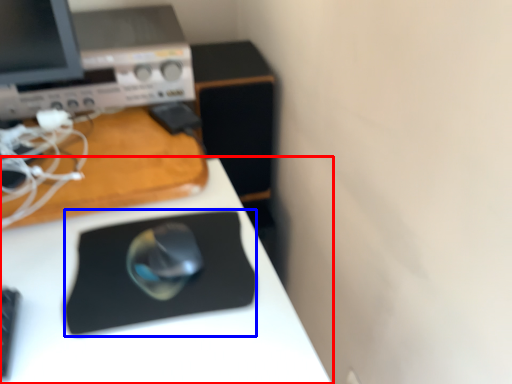
Question: Which of the following is the farthest to the observer, desk (highlighted by a red box) or mousepad (highlighted by a blue box)?

Choices:
 (A) desk
 (B) mousepad

Answer: (B)